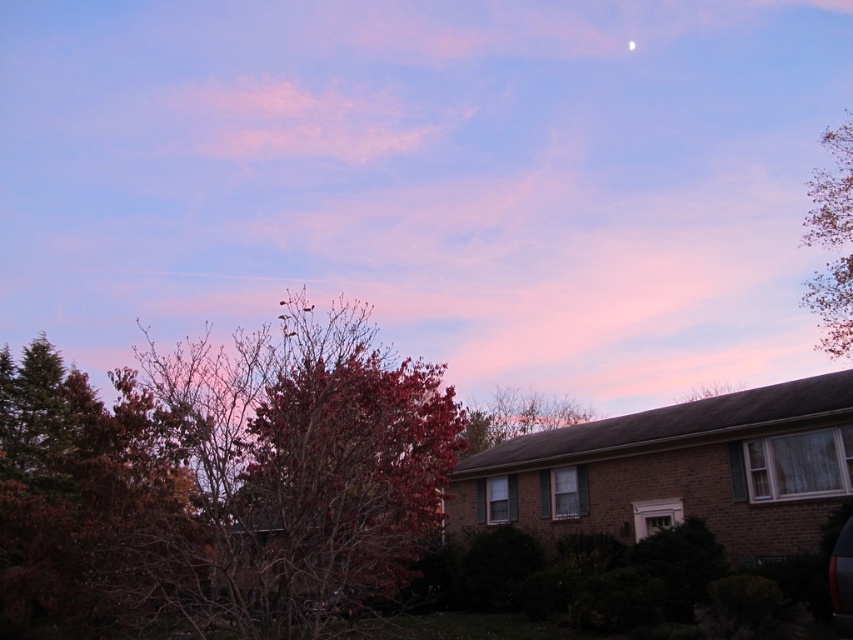
Is pink cotton candy cloud at upper center below leaves at upper center?

Actually, pink cotton candy cloud at upper center is above leaves at upper center.

Can you confirm if pink cotton candy cloud at upper center is wider than leaves at upper center?

Correct, the width of pink cotton candy cloud at upper center exceeds that of leaves at upper center.

Between point (372, 99) and point (550, 406), which one is positioned in front?

Point (550, 406)

Identify the location of pink cotton candy cloud at upper center. (428, 180).

Can you confirm if reddish-brown bark tree at center-left is wider than white glossy moon at upper center?

Yes, reddish-brown bark tree at center-left is wider than white glossy moon at upper center.

The height and width of the screenshot is (640, 853). What do you see at coordinates (222, 481) in the screenshot?
I see `reddish-brown bark tree at center-left` at bounding box center [222, 481].

This screenshot has width=853, height=640. I want to click on reddish-brown bark tree at center-left, so [222, 481].

Does reddish-brown bark tree at center-left come behind green leafy tree at upper right?

No, it is in front of green leafy tree at upper right.

How much distance is there between reddish-brown bark tree at center-left and green leafy tree at upper right?

A distance of 106.89 feet exists between reddish-brown bark tree at center-left and green leafy tree at upper right.

This screenshot has width=853, height=640. Find the location of `reddish-brown bark tree at center-left`. reddish-brown bark tree at center-left is located at coordinates (222, 481).

I want to click on reddish-brown bark tree at center-left, so click(x=222, y=481).